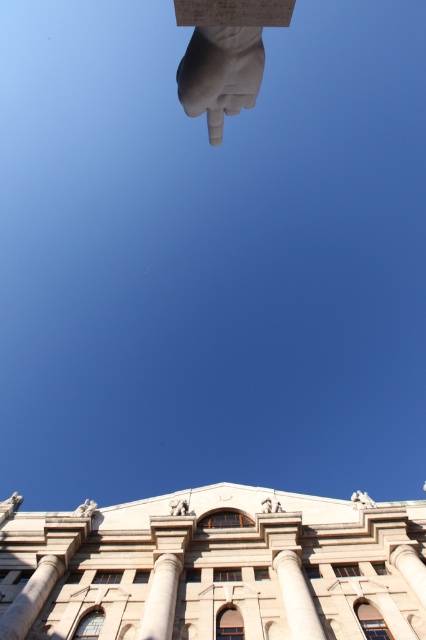
You are standing 25 meters away from a classical building with a large white hand sculpture pointing downward. You want to reach the point marked as point (414,620) on the image. Is this point closer to you than the building?

The distance of point (414,620) from viewer is 28.27 meters, so the point is farther away than the building which is at 25 meters. Therefore, the point is not closer to you than the building.